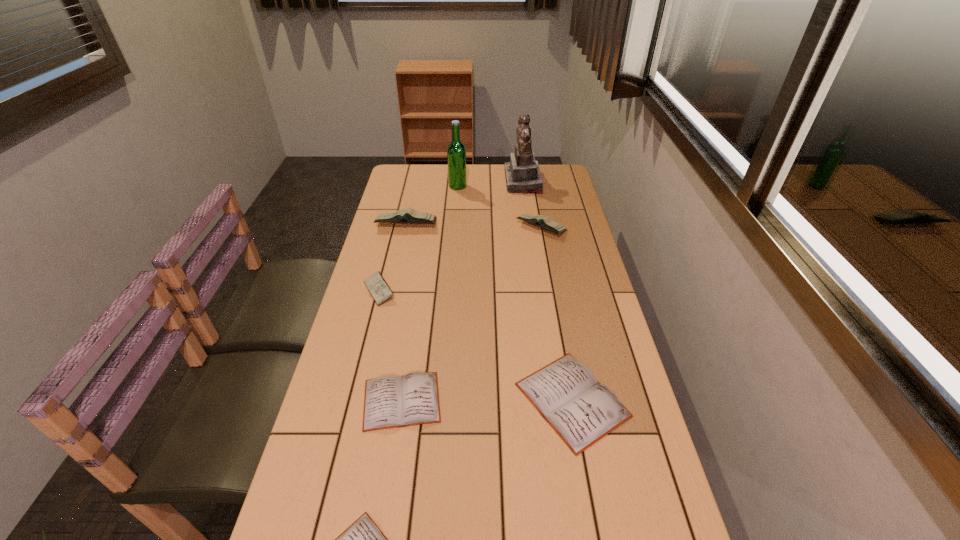
Locate an element on the screen. The height and width of the screenshot is (540, 960). figurine is located at coordinates (522, 173).

I want to click on beer bottle, so click(x=456, y=152).

At what (x,y) coordinates should I click in order to perform the action: click on the biggest pink diary. Please return your answer as a coordinate pair (x, y). The image size is (960, 540). Looking at the image, I should click on (410, 215).

I want to click on the third tallest object, so click(410, 215).

This screenshot has height=540, width=960. Identify the location of the fifth shortest object. (548, 223).

This screenshot has width=960, height=540. Identify the location of the second biggest pink diary. (548, 223).

The height and width of the screenshot is (540, 960). In order to click on the third tallest diary in this screenshot , I will do `click(377, 286)`.

Where is `the fifth farthest object`? the fifth farthest object is located at coordinates (377, 286).

At what (x,y) coordinates should I click in order to perform the action: click on the rightmost white diary. Please return your answer as a coordinate pair (x, y). Image resolution: width=960 pixels, height=540 pixels. Looking at the image, I should click on (581, 410).

Locate an element on the screen. the third shortest diary is located at coordinates (581, 410).